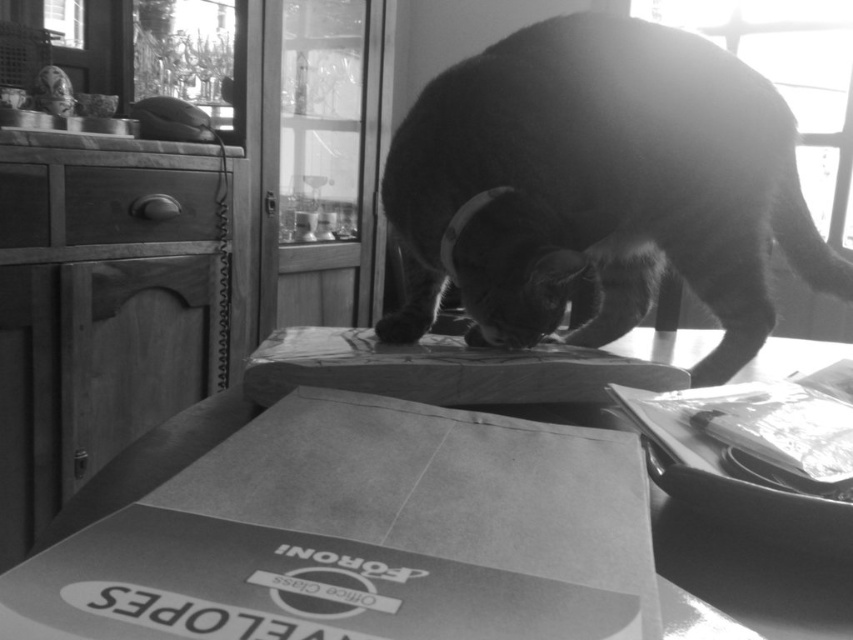
Question: Which point is farther to the camera?

Choices:
 (A) smooth cardboard envelope at center
 (B) cardboard box at center

Answer: (B)

Question: Can you confirm if soft fur cat at center is smaller than cardboard box at center?

Choices:
 (A) yes
 (B) no

Answer: (B)

Question: Is smooth cardboard envelope at center positioned before cardboard box at center?

Choices:
 (A) no
 (B) yes

Answer: (B)

Question: Among these points, which one is farthest from the camera?

Choices:
 (A) click(x=258, y=404)
 (B) click(x=616, y=452)

Answer: (A)

Question: Based on their relative distances, which object is nearer to the smooth cardboard envelope at center?

Choices:
 (A) soft fur cat at center
 (B) cardboard box at center

Answer: (B)

Question: Is smooth cardboard envelope at center closer to camera compared to cardboard box at center?

Choices:
 (A) no
 (B) yes

Answer: (B)